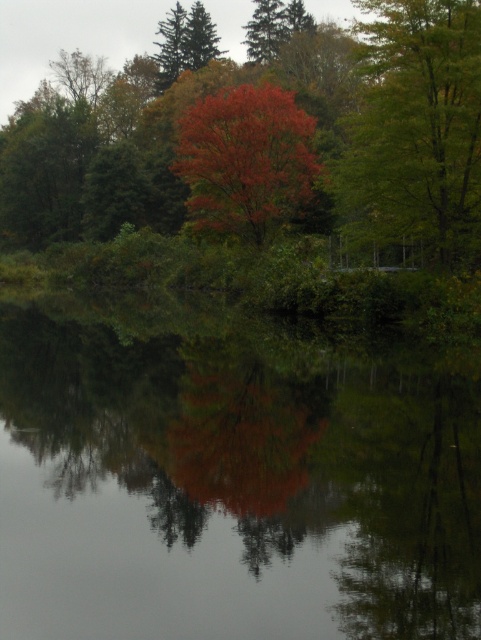
You are an artist painting the scene and want to ensure the vivid red leaves at center and shiny red leaves at center are proportionally accurate. Which of these two objects is taller?

The vivid red leaves at center is taller than the shiny red leaves at center according to the description.

You are standing at the center of the scene and want to reach both the point at coordinates point (146, 532) and the point at coordinates point (456, 113). Which point will you reach first while moving forward?

You will reach point (146, 532) first because it is closer to the camera than point (456, 113), so it is nearer to your starting position.

You are an artist sketching the scene and notice both the vivid red leaves at center and the shiny red leaves at center. Which set of leaves do you see first when looking directly at the center of the image?

The vivid red leaves at center are seen first because they are positioned in front of the shiny red leaves at center, making them more prominent in the visual hierarchy.